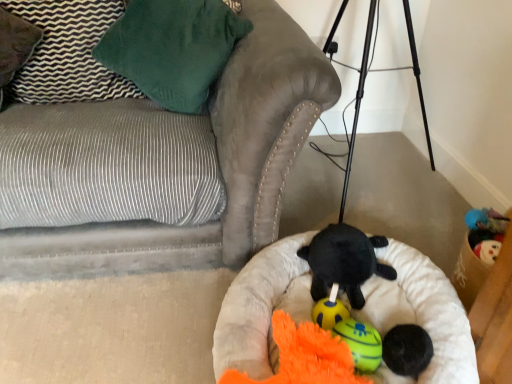
Question: Would you say black plush turtle at center, which is the 2th toy from back to front, is part of orange fuzzy toy at center, the first toy in the front-to-back sequence,'s contents?

Choices:
 (A) yes
 (B) no

Answer: (B)

Question: Is orange fuzzy toy at center, the first toy in the front-to-back sequence, in contact with black plush turtle at center, which is the 2th toy from back to front?

Choices:
 (A) yes
 (B) no

Answer: (B)

Question: From a real-world perspective, is orange fuzzy toy at center, arranged as the 5th toy when viewed from the back, physically above black plush turtle at center, positioned as the fourth toy in front-to-back order?

Choices:
 (A) no
 (B) yes

Answer: (A)

Question: Is orange fuzzy toy at center, arranged as the 5th toy when viewed from the back, oriented away from black plush turtle at center, positioned as the fourth toy in front-to-back order?

Choices:
 (A) yes
 (B) no

Answer: (A)

Question: Is orange fuzzy toy at center, the first toy in the front-to-back sequence, wider than black plush turtle at center, positioned as the fourth toy in front-to-back order?

Choices:
 (A) yes
 (B) no

Answer: (A)

Question: Is orange fuzzy toy at center, the first toy in the front-to-back sequence, positioned in front of black plush turtle at center, positioned as the fourth toy in front-to-back order?

Choices:
 (A) no
 (B) yes

Answer: (B)

Question: From the image's perspective, is black plush turtle at center, positioned as the fourth toy in front-to-back order, on soft beige dog bed at center?

Choices:
 (A) yes
 (B) no

Answer: (A)

Question: Does black plush turtle at center, positioned as the fourth toy in front-to-back order, turn towards soft beige dog bed at center?

Choices:
 (A) no
 (B) yes

Answer: (B)

Question: Is black plush turtle at center, positioned as the fourth toy in front-to-back order, to the right of soft beige dog bed at center from the viewer's perspective?

Choices:
 (A) yes
 (B) no

Answer: (A)

Question: Can you confirm if black plush turtle at center, positioned as the fourth toy in front-to-back order, is thinner than soft beige dog bed at center?

Choices:
 (A) no
 (B) yes

Answer: (B)

Question: Is black plush turtle at center, which is the 2th toy from back to front, positioned far away from soft beige dog bed at center?

Choices:
 (A) yes
 (B) no

Answer: (B)

Question: Considering the relative sizes of black plush turtle at center, positioned as the fourth toy in front-to-back order, and soft beige dog bed at center in the image provided, is black plush turtle at center, positioned as the fourth toy in front-to-back order, taller than soft beige dog bed at center?

Choices:
 (A) no
 (B) yes

Answer: (A)

Question: Is soft beige dog bed at center closer to camera compared to soft black ball at center, which is the 4th toy from back to front?

Choices:
 (A) yes
 (B) no

Answer: (A)